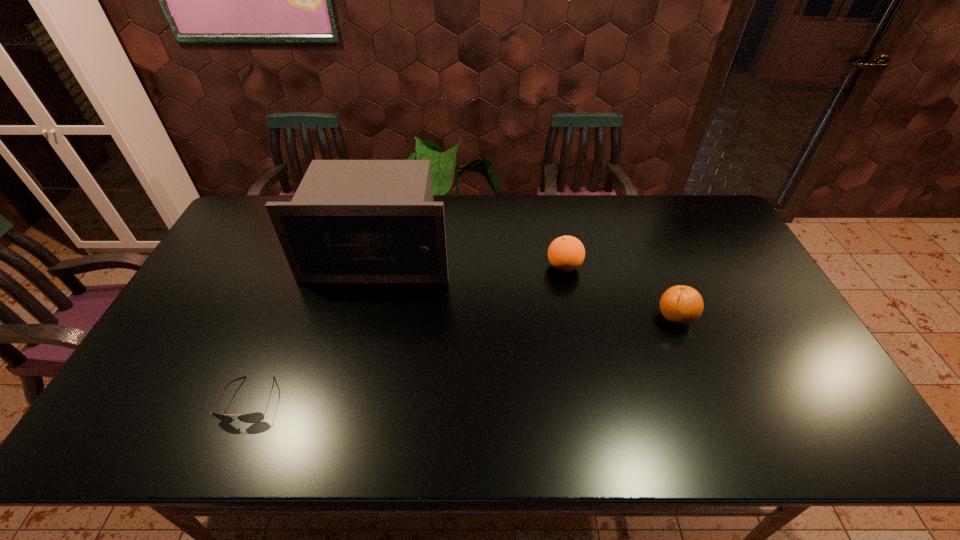
Image resolution: width=960 pixels, height=540 pixels. In order to click on object that is at the far edge in this screenshot , I will do `click(350, 221)`.

I want to click on object that is at the near edge, so click(x=255, y=417).

The image size is (960, 540). What are the coordinates of `vacant space at the far edge of the desktop` in the screenshot? It's located at (483, 213).

At what (x,y) coordinates should I click in order to perform the action: click on vacant area at the left edge. Please return your answer as a coordinate pair (x, y). Looking at the image, I should click on (214, 295).

What are the coordinates of `free space at the right edge` in the screenshot? It's located at (731, 247).

Image resolution: width=960 pixels, height=540 pixels. In the image, there is a desktop. What are the coordinates of `free space at the far left corner` in the screenshot? It's located at (237, 230).

Identify the location of vacant point at the near left corner. This screenshot has height=540, width=960. (123, 427).

Locate an element on the screen. vacant space at the far right corner of the desktop is located at coordinates (708, 222).

Image resolution: width=960 pixels, height=540 pixels. In order to click on blank region between the nearest object and the rightmost object in this screenshot , I will do `click(463, 359)`.

This screenshot has height=540, width=960. What are the coordinates of `free space between the nearest object and the right orange` in the screenshot? It's located at (463, 359).